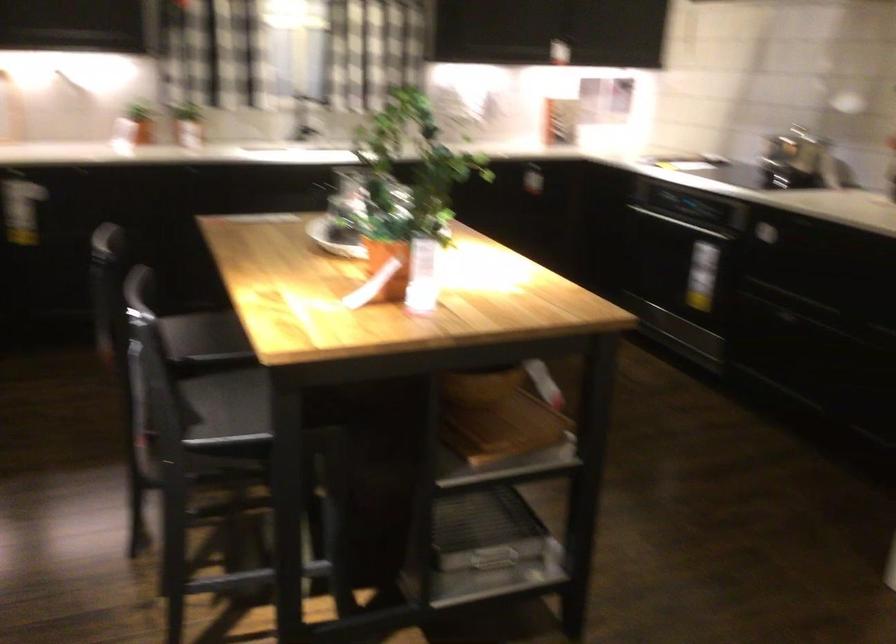
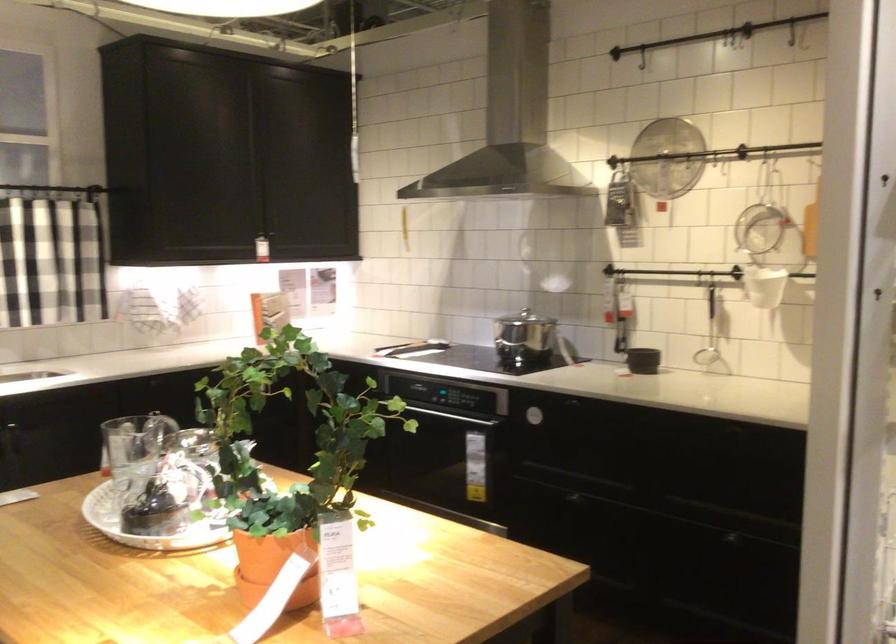
Question: The camera is either moving clockwise (left) or counter-clockwise (right) around the object. The first image is from the beginning of the video and the second image is from the end. Is the camera moving left or right when shooting the video?

Choices:
 (A) Left
 (B) Right

Answer: (A)